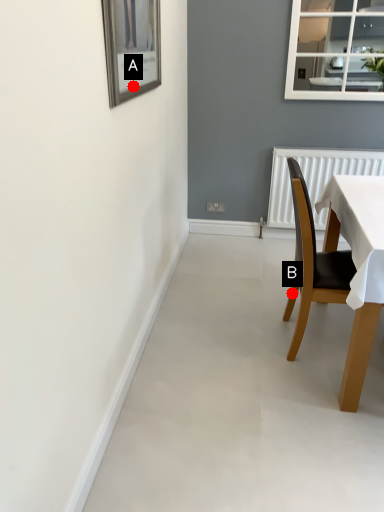
Question: Two points are circled on the image, labeled by A and B beside each circle. Which point appears farthest from the camera in this image?

Choices:
 (A) A is further
 (B) B is further

Answer: (B)